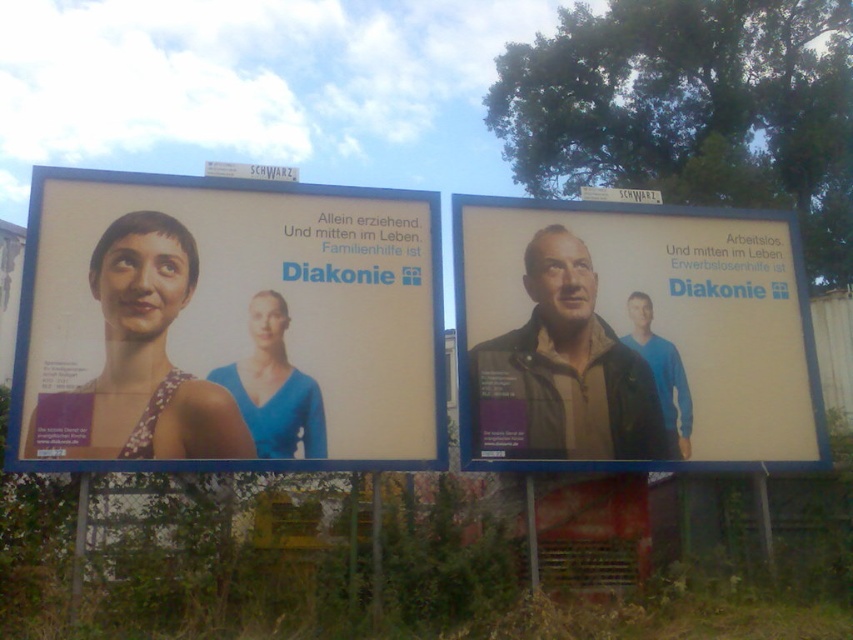
You are a delivery person standing at the entrance of the Diakonie office and see the matte plastic billboard at center and the matte brown jacket at center. You need to deliver a package to the closest object. Which one should you deliver to first?

The matte plastic billboard at center is 1.29 meters away from the matte brown jacket at center, so the matte brown jacket at center is closer and should be delivered to first.

You are a pedestrian standing in front of the two Diakonie billboards. You notice the matte plastic billboard at center and the matte brown jacket at center. Which object is positioned to the left?

The matte plastic billboard at center is to the left of the matte brown jacket at center, so the matte plastic billboard at center is positioned to the left.

You are a painter standing at the base of the two billboards. You need to paint the matte plastic billboard at center and the matte brown jacket at center. Which object will require you to reach higher to paint its top edge?

The matte plastic billboard at center has a greater height compared to the matte brown jacket at center, so you will need to reach higher to paint its top edge.